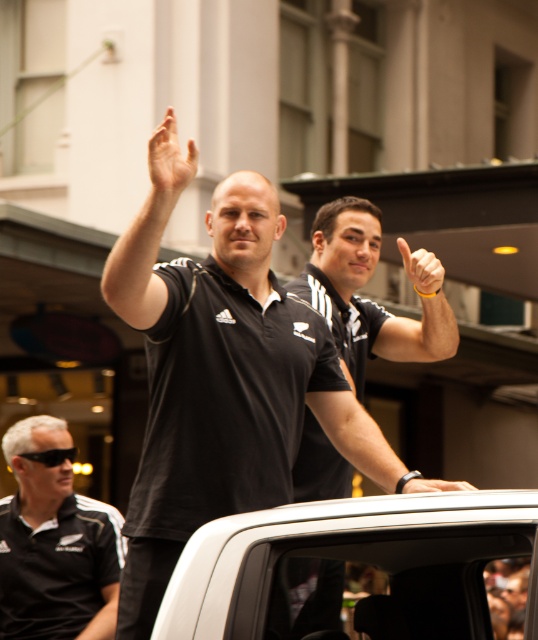
You are a photographer trying to capture a clear shot of both the black matte shirt at lower left and the black matte wristband at upper center in the scene. Based on their positions, which object should you focus on first to ensure both are in frame?

The black matte shirt at lower left has a lesser height compared to the black matte wristband at upper center. Therefore, you should focus on the black matte shirt at lower left first to ensure both are in frame.

You are standing at the point marked by the coordinates point (54, 541), which is labeled as black matte shirt at lower left. If you turn 90 degrees to your right, which direction will you be facing?

The point (54, 541) is labeled as black matte shirt at lower left. Since the lower left position in an image typically corresponds to the bottom left corner, turning 90 degrees to the right from this position would face you towards the bottom right direction.